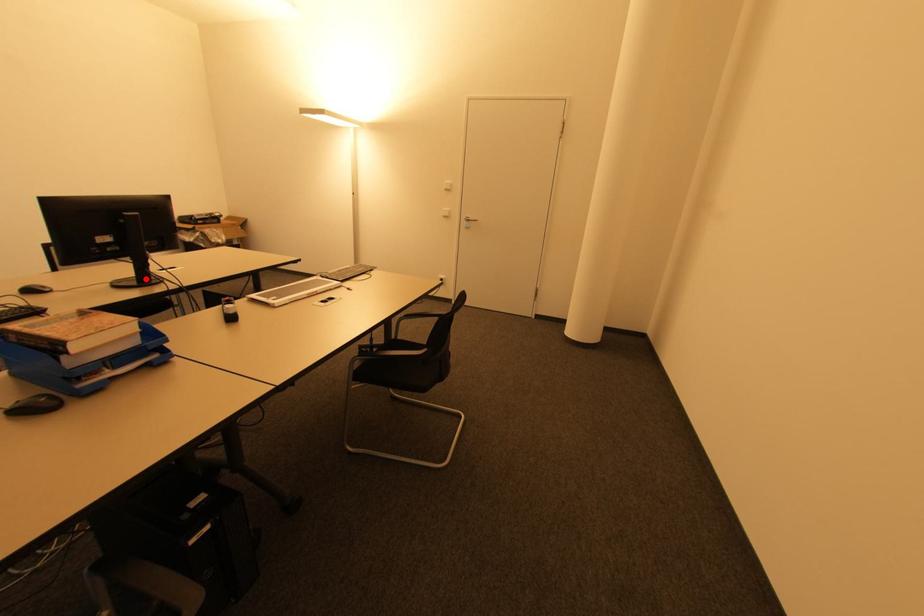
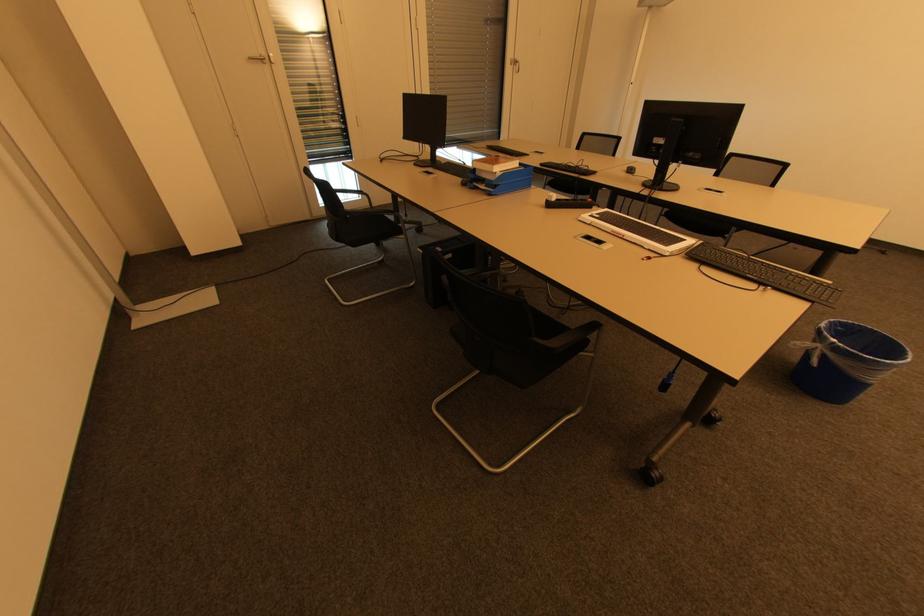
In the second image, find the point that corresponds to the highlighted location in the first image.

(660, 183)